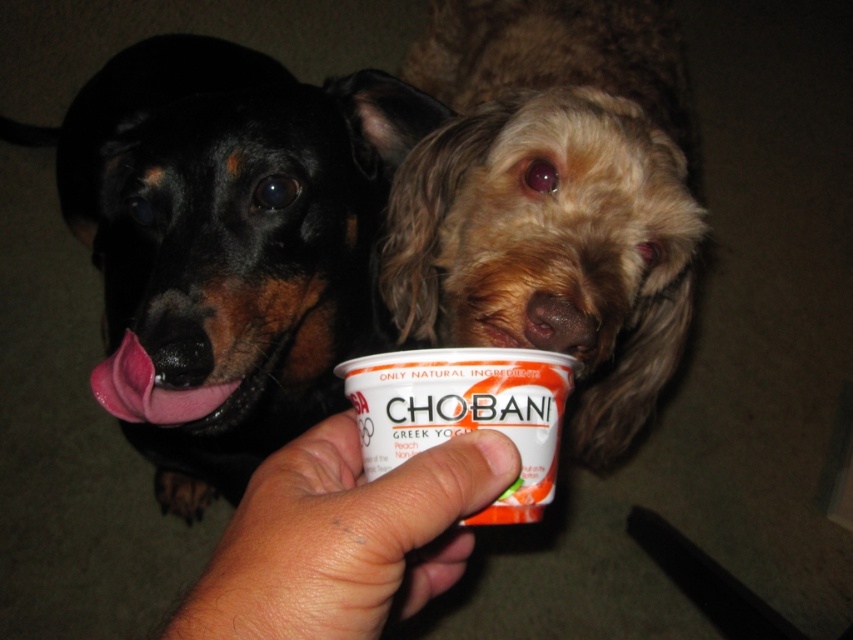
You are a dog owner who wants to give your pet a treat. You see the shaggy brown fur at center and the Chobani Greek yogurt container in the image. Which one is closer to you?

The shaggy brown fur at center is closer to the viewer than the Chobani Greek yogurt container, so the shaggy brown fur at center is closer.